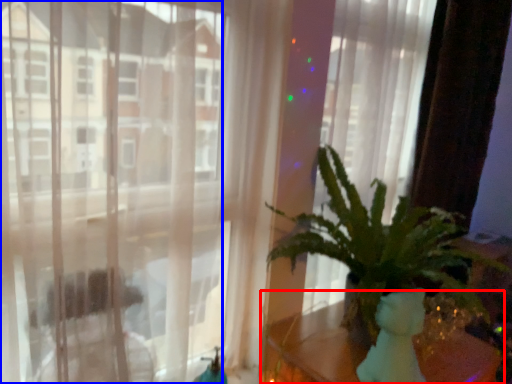
Question: Which of the following is the farthest to the observer, table (highlighted by a red box) or window (highlighted by a blue box)?

Choices:
 (A) table
 (B) window

Answer: (A)